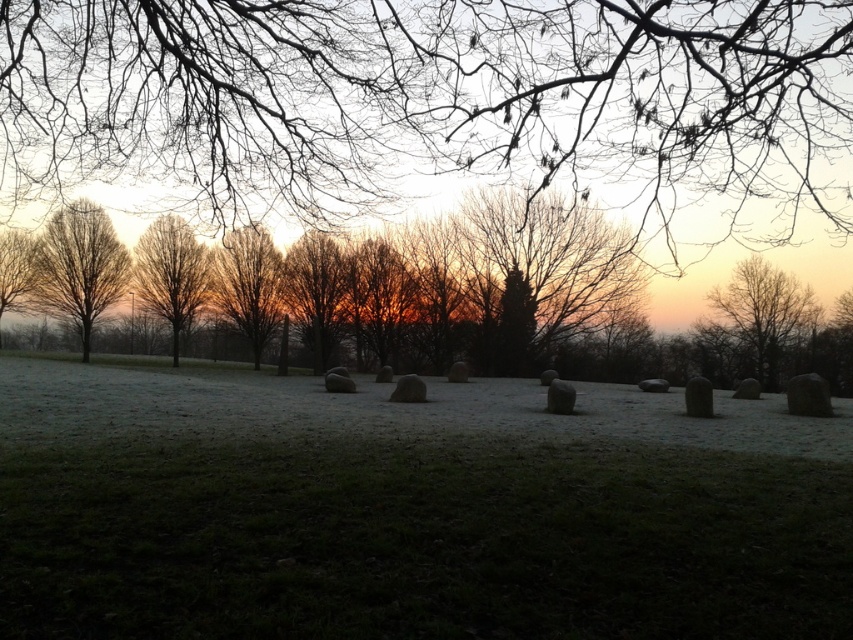
Question: Is bare branches at upper center below brown textured tree at center?

Choices:
 (A) yes
 (B) no

Answer: (B)

Question: Can you confirm if bare branches at upper center is smaller than bare wood tree at right?

Choices:
 (A) yes
 (B) no

Answer: (B)

Question: Considering the relative positions of bare branches at left and brown textured tree at center in the image provided, where is bare branches at left located with respect to brown textured tree at center?

Choices:
 (A) right
 (B) left

Answer: (B)

Question: Which object appears closest to the camera in this image?

Choices:
 (A) bare wood tree at center
 (B) bare branches at center

Answer: (B)

Question: Among these points, which one is farthest from the camera?

Choices:
 (A) (177, 256)
 (B) (323, 324)
 (C) (268, 292)

Answer: (B)

Question: Which of these objects is positioned closest to the smooth bark tree at left?

Choices:
 (A) bare branches at center
 (B) brown matte tree at center
 (C) bare branches at left
 (D) bare branches at upper center

Answer: (C)